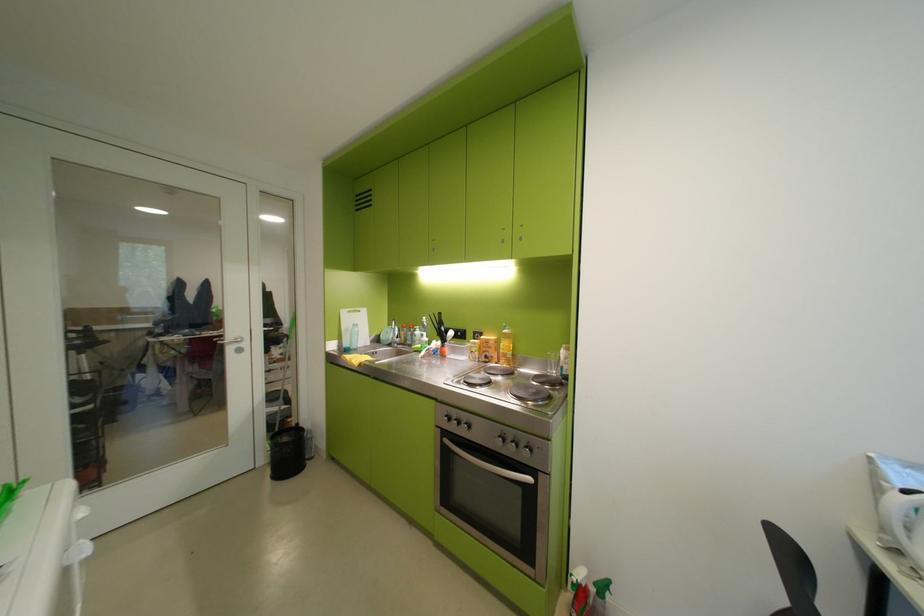
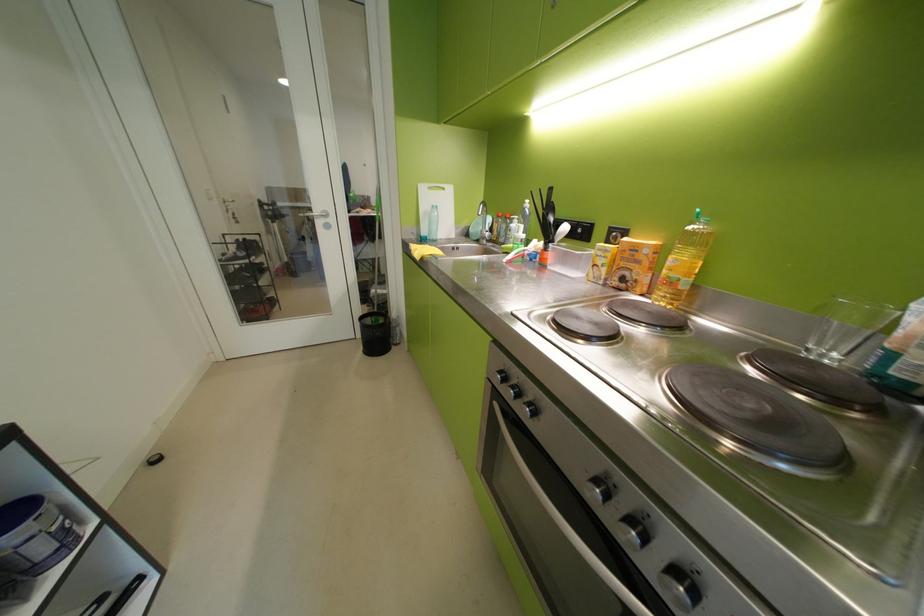
In the second image, find the point that corresponds to [357,345] in the first image.

(433, 233)